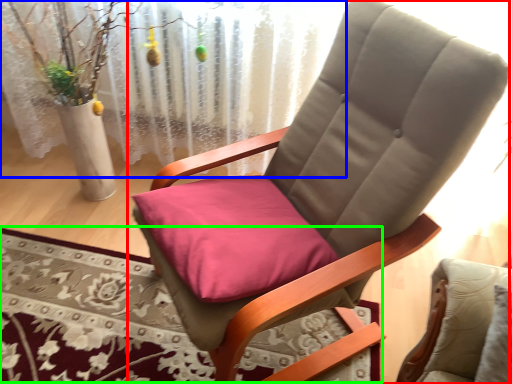
Question: Which object is positioned closest to chair (highlighted by a red box)? Select from curtain (highlighted by a blue box) and mat (highlighted by a green box).

Choices:
 (A) curtain
 (B) mat

Answer: (B)